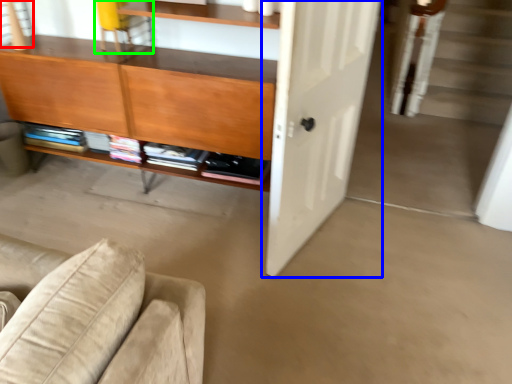
Question: Considering the real-world distances, which object is closest to window (highlighted by a red box)? door (highlighted by a blue box) or chair (highlighted by a green box).

Choices:
 (A) door
 (B) chair

Answer: (B)